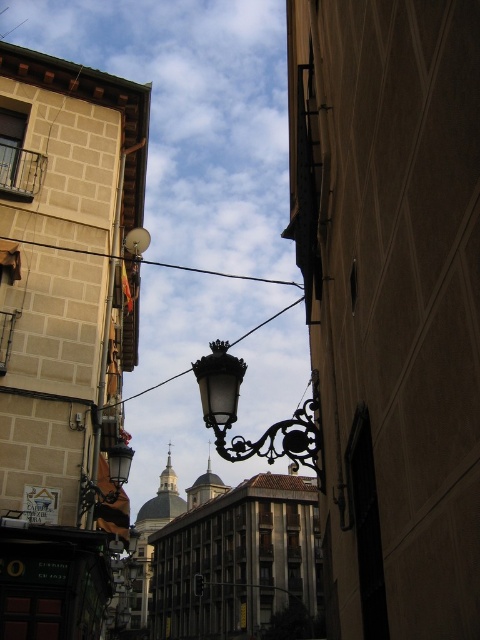
Is black wire at upper center positioned at the back of black glass wire at center?

Yes, it is behind black glass wire at center.

Can you confirm if black wire at upper center is wider than black glass wire at center?

Incorrect, black wire at upper center's width does not surpass black glass wire at center's.

Image resolution: width=480 pixels, height=640 pixels. What do you see at coordinates (216, 273) in the screenshot?
I see `black wire at upper center` at bounding box center [216, 273].

At what (x,y) coordinates should I click in order to perform the action: click on black wire at upper center. Please return your answer as a coordinate pair (x, y). Looking at the image, I should click on (216, 273).

Can you confirm if polished brass lantern at center is positioned to the left of black wire at upper center?

In fact, polished brass lantern at center is to the right of black wire at upper center.

Who is higher up, polished brass lantern at center or black wire at upper center?

black wire at upper center is above.

This screenshot has height=640, width=480. Describe the element at coordinates (267, 428) in the screenshot. I see `polished brass lantern at center` at that location.

Locate an element on the screen. polished brass lantern at center is located at coordinates (267, 428).

Which is below, polished brass lantern at center or black glass wire at center?

black glass wire at center is below.

Between point (274, 426) and point (131, 400), which one is positioned behind?

Positioned behind is point (131, 400).

I want to click on polished brass lantern at center, so click(x=267, y=428).